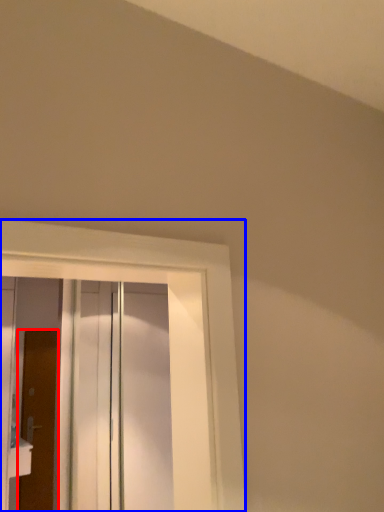
Question: Which point is closer to the camera, door (highlighted by a red box) or window (highlighted by a blue box)?

Choices:
 (A) door
 (B) window

Answer: (B)